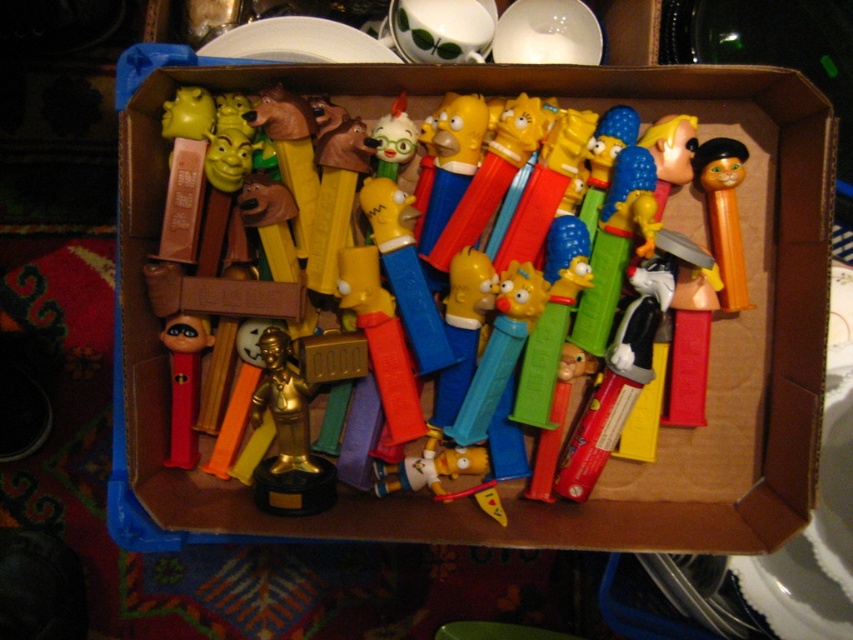
Question: Is multicolored plastic toys at center positioned behind orange matte cat at right?

Choices:
 (A) no
 (B) yes

Answer: (A)

Question: Which of the following is the farthest from the observer?

Choices:
 (A) orange matte cat at right
 (B) red plastic pez dispenser at center
 (C) multicolored plastic toys at center

Answer: (B)

Question: Which point appears farthest from the camera in this image?

Choices:
 (A) (175, 326)
 (B) (704, 193)
 (C) (810, 112)

Answer: (B)

Question: Is orange matte cat at right smaller than red plastic pez dispenser at center?

Choices:
 (A) yes
 (B) no

Answer: (B)

Question: Which point appears farthest from the camera in this image?

Choices:
 (A) tap(172, 340)
 (B) tap(697, 152)

Answer: (B)

Question: Can you confirm if orange matte cat at right is thinner than red plastic pez dispenser at center?

Choices:
 (A) yes
 (B) no

Answer: (B)